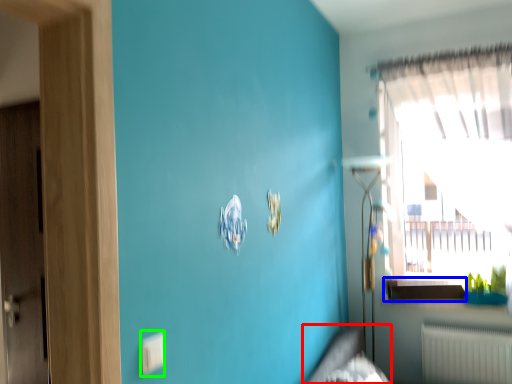
Question: Which object is positioned closest to bed frame (highlighted by a red box)? Select from window sill (highlighted by a blue box) and electric outlet (highlighted by a green box).

Choices:
 (A) window sill
 (B) electric outlet

Answer: (A)